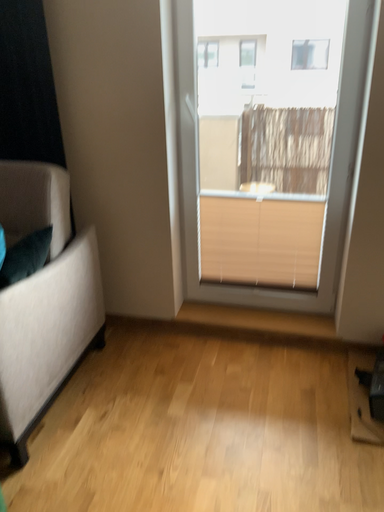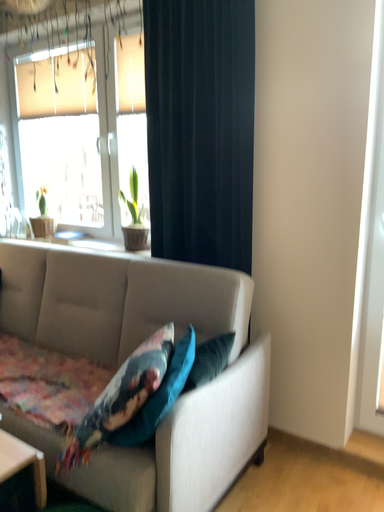
Question: Which way did the camera rotate in the video?

Choices:
 (A) rotated left
 (B) rotated right

Answer: (A)